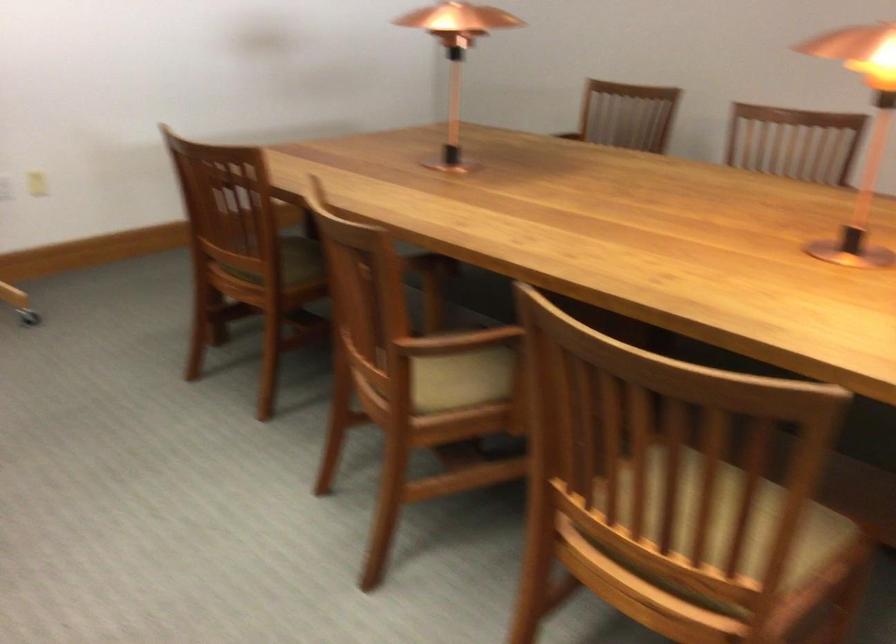
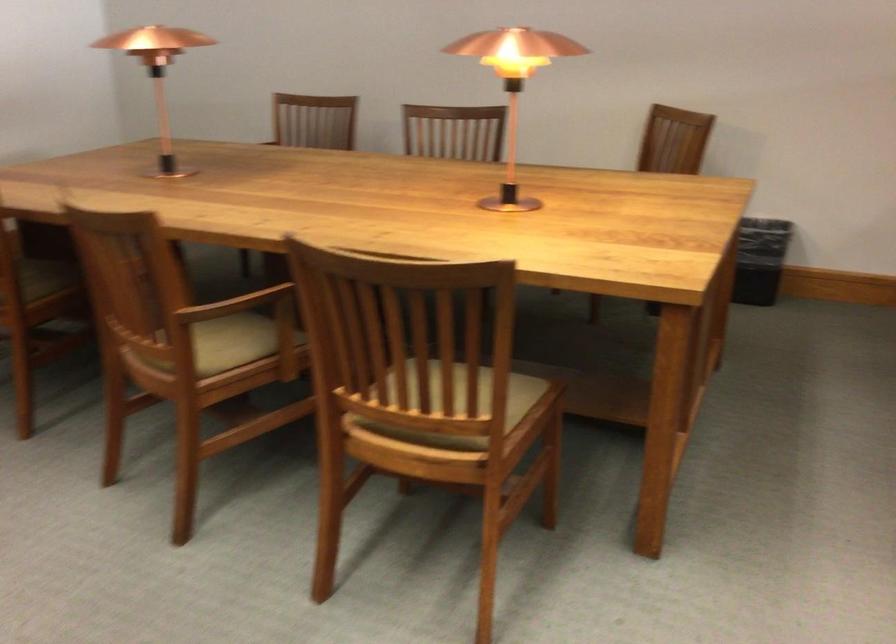
Where in the second image is the point corresponding to (459,375) from the first image?

(228, 343)